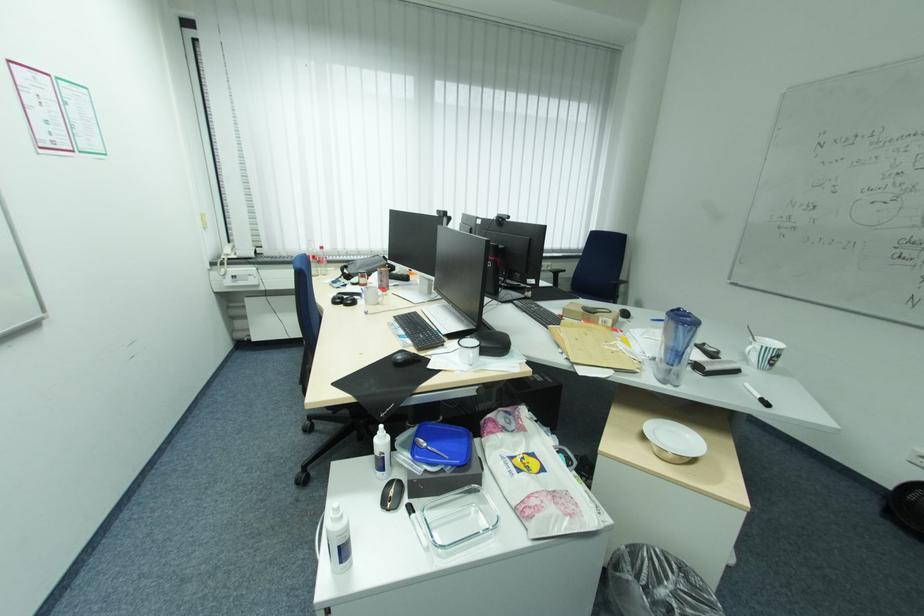
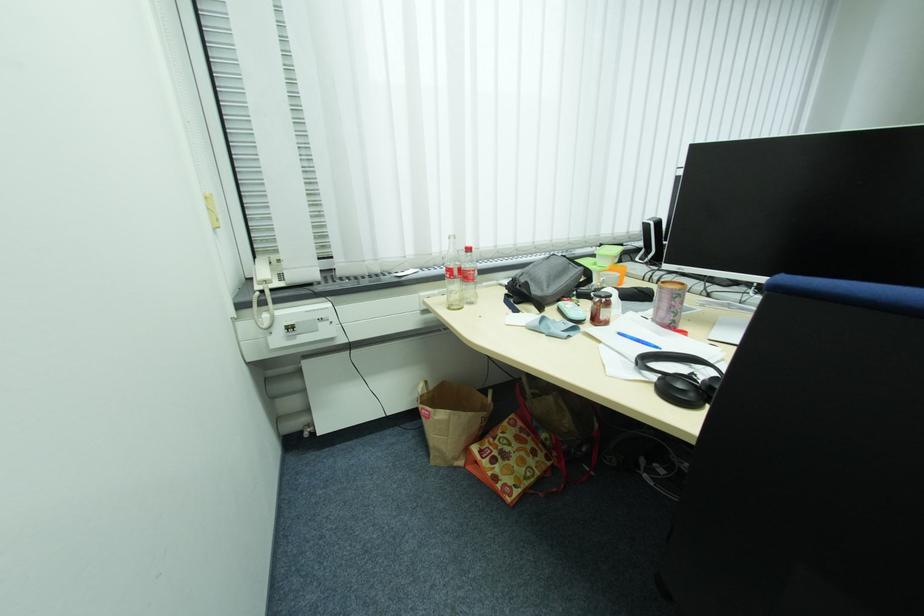
Question: I am providing you with two images of the same scene from different viewpoints. After the viewpoint changes to image2, which objects are now occluded?

Choices:
 (A) white tablet frame
 (B) light blue case
 (C) black headphones
 (D) patterned cylindrical cup

Answer: (C)